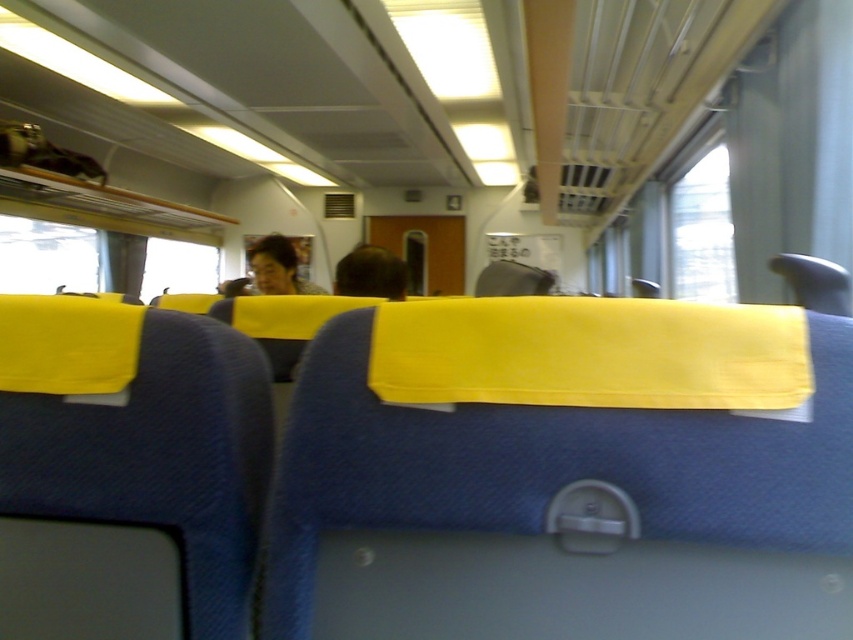
Question: Which object appears farthest from the camera in this image?

Choices:
 (A) matte black hair at center
 (B) brown hair at center

Answer: (A)

Question: Which object appears closest to the camera in this image?

Choices:
 (A) matte black hair at center
 (B) brown hair at center

Answer: (B)

Question: Is brown hair at center below matte black hair at center?

Choices:
 (A) no
 (B) yes

Answer: (B)

Question: Among these objects, which one is farthest from the camera?

Choices:
 (A) matte black hair at center
 (B) brown hair at center

Answer: (A)

Question: Is brown hair at center to the left of matte black hair at center from the viewer's perspective?

Choices:
 (A) yes
 (B) no

Answer: (B)

Question: Is the position of brown hair at center more distant than that of matte black hair at center?

Choices:
 (A) no
 (B) yes

Answer: (A)